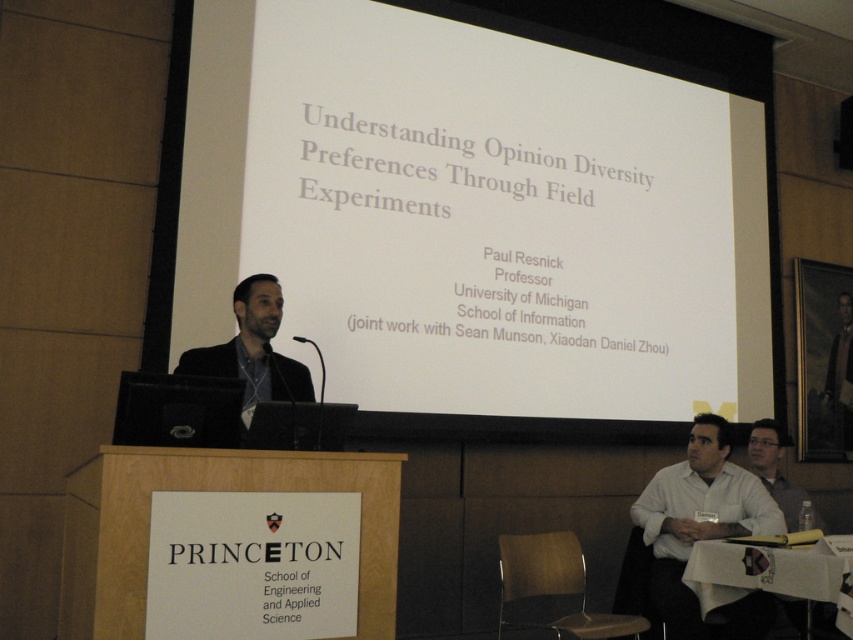
You are attending a presentation at Princeton University and notice a white shirt at lower right. Where exactly is the white shirt located in the image?

The white shirt at lower right is located at point 0.831 in the x coordinate and 0.825 in the y coordinate.

You are attending a lecture at Princeton University and see the point marked at coordinate (488, 209). What object is located at that coordinate?

The point at coordinate (488, 209) indicates the white matte projection screen at upper center.